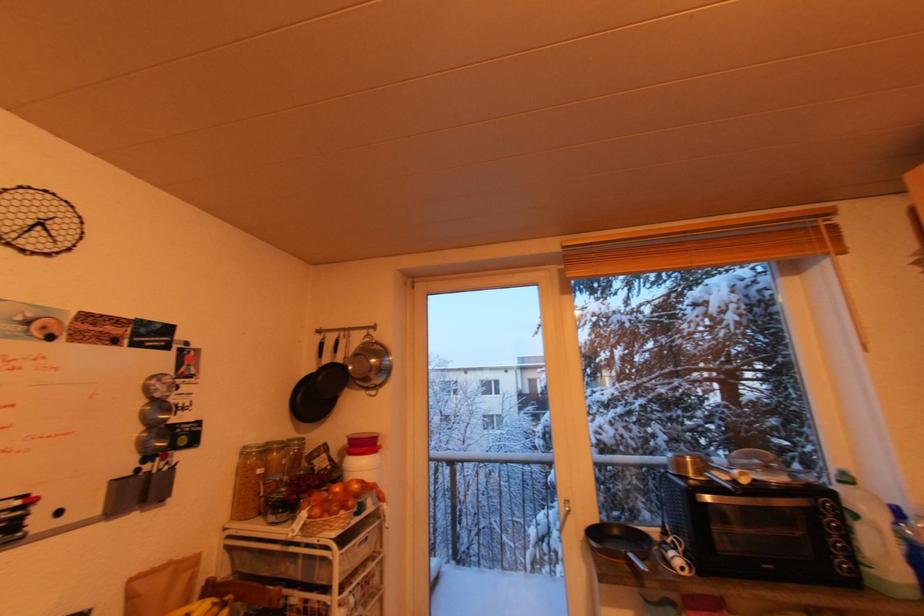
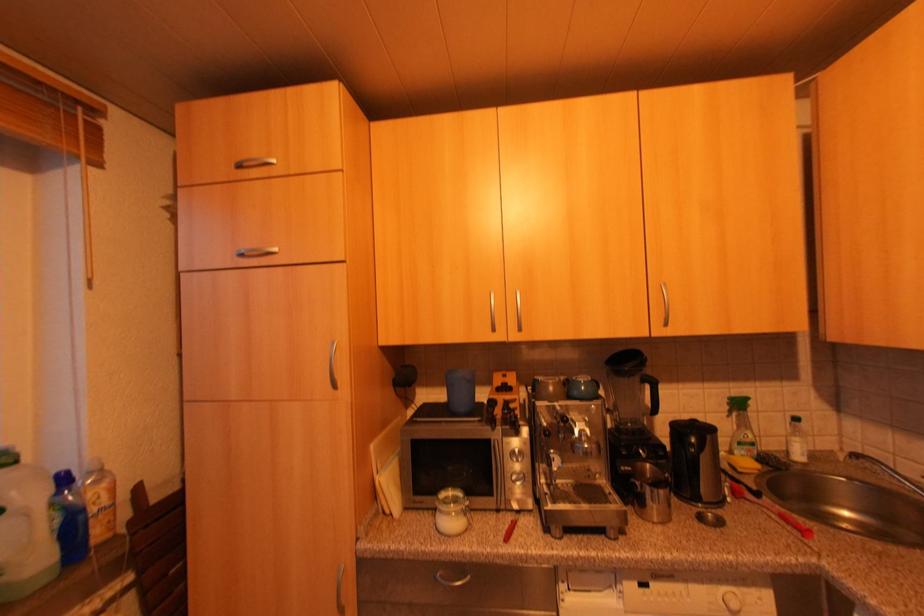
Question: The camera is either moving clockwise (left) or counter-clockwise (right) around the object. The first image is from the beginning of the video and the second image is from the end. Is the camera moving left or right when shooting the video?

Choices:
 (A) Left
 (B) Right

Answer: (A)